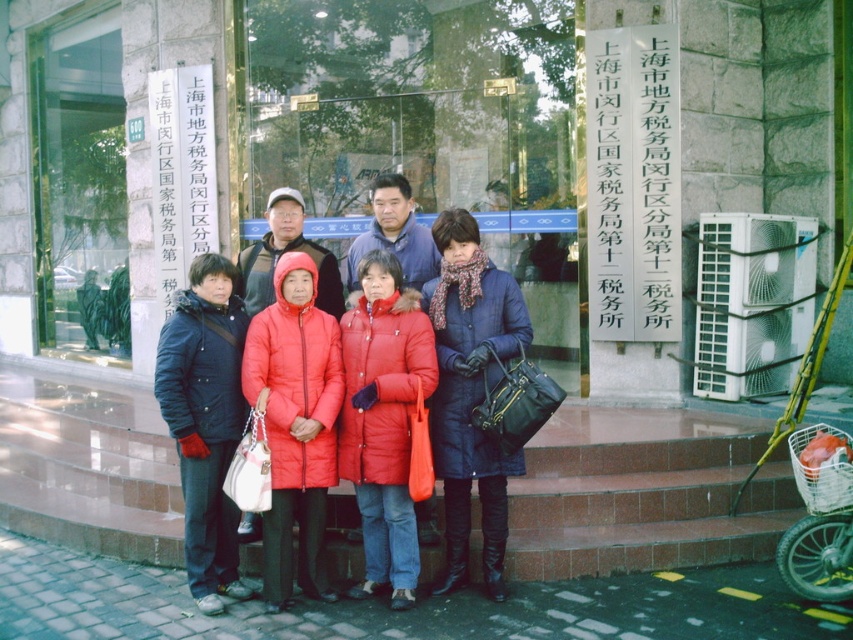
You are a photographer trying to capture a group photo of the red down jackets at center and the red down coat at center. Which one of these two items will appear larger in the photo?

The red down jackets at center will appear larger in the photo because it is bigger than the red down coat at center.

You are standing at the point marked by the coordinate point at [213,442]. You want to approach the building entrance. Is the distance between you and the entrance sufficient to allow you to walk directly towards it without needing to adjust your path?

The distance between you and the entrance is 4.65 meters, which is sufficient to walk directly towards it without needing to adjust your path.

You are standing at the entrance of the Shanghai Municipal Tax Bureau building. There are two points marked on the ground in front of you. The first point is at coordinates point (299, 195) and the second point is at point (408, 413). If you want to walk towards the first point, which direction should you move relative to the second point?

Point (299, 195) is behind point (408, 413), so to walk towards the first point, you should move in the direction opposite to the second point.